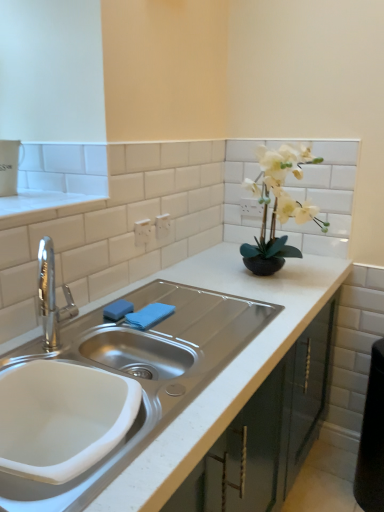
Question: Can you confirm if white matte countertop at center is taller than blue fabric towel at sink?

Choices:
 (A) yes
 (B) no

Answer: (A)

Question: Is white matte countertop at center far from blue fabric towel at sink?

Choices:
 (A) yes
 (B) no

Answer: (B)

Question: Is white matte countertop at center aimed at blue fabric towel at sink?

Choices:
 (A) yes
 (B) no

Answer: (A)

Question: From the image's perspective, would you say white matte countertop at center is positioned over blue fabric towel at sink?

Choices:
 (A) no
 (B) yes

Answer: (A)

Question: Can you confirm if white matte countertop at center is thinner than blue fabric towel at sink?

Choices:
 (A) yes
 (B) no

Answer: (B)

Question: Is white matte countertop at center not within blue fabric towel at sink?

Choices:
 (A) no
 (B) yes

Answer: (B)

Question: Is blue fabric towel at sink further to the viewer compared to white ceramic sink at lower left?

Choices:
 (A) no
 (B) yes

Answer: (B)

Question: Considering the relative sizes of blue fabric towel at sink and white ceramic sink at lower left in the image provided, is blue fabric towel at sink thinner than white ceramic sink at lower left?

Choices:
 (A) no
 (B) yes

Answer: (B)

Question: Is blue fabric towel at sink next to white ceramic sink at lower left?

Choices:
 (A) no
 (B) yes

Answer: (A)

Question: Is blue fabric towel at sink smaller than white ceramic sink at lower left?

Choices:
 (A) no
 (B) yes

Answer: (B)

Question: From the image's perspective, does blue fabric towel at sink appear lower than white ceramic sink at lower left?

Choices:
 (A) yes
 (B) no

Answer: (B)

Question: Is blue fabric towel at sink taller than white ceramic sink at lower left?

Choices:
 (A) yes
 (B) no

Answer: (B)

Question: Is blue fabric towel at sink facing towards white matte countertop at center?

Choices:
 (A) yes
 (B) no

Answer: (A)